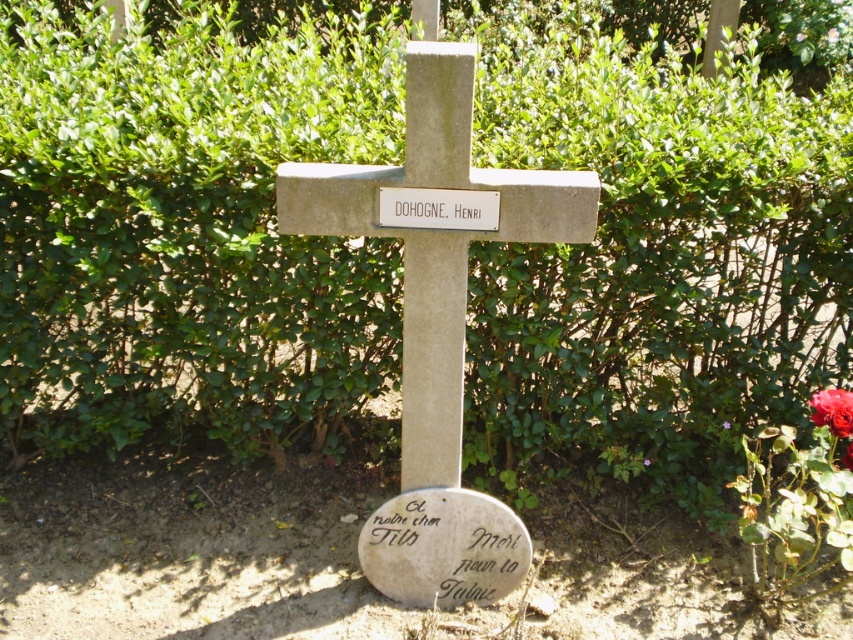
Question: Which of the following is the closest to the observer?

Choices:
 (A) red matte rose at lower right
 (B) red matte rose at center right
 (C) red rose at center right
 (D) white stone plaque at center

Answer: (D)

Question: Which is farther from the red rose at center right?

Choices:
 (A) white stone plaque at center
 (B) red matte rose at lower right
 (C) smooth stone cross at center

Answer: (A)

Question: Is red matte rose at lower right above red matte rose at center right?

Choices:
 (A) yes
 (B) no

Answer: (A)

Question: Is red matte rose at lower right to the left of red matte rose at center right from the viewer's perspective?

Choices:
 (A) yes
 (B) no

Answer: (B)

Question: Which point is closer to the camera?

Choices:
 (A) red matte rose at center right
 (B) red matte rose at lower right

Answer: (B)

Question: Does smooth stone cross at center appear over red matte rose at lower right?

Choices:
 (A) no
 (B) yes

Answer: (B)